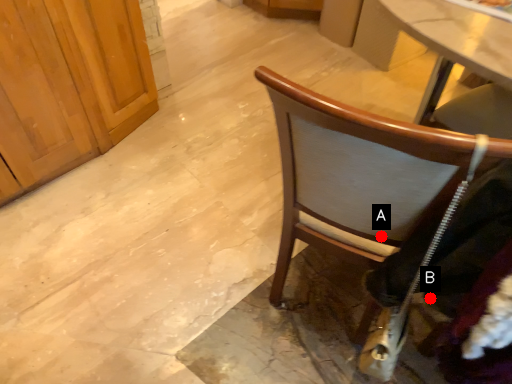
Question: Two points are circled on the image, labeled by A and B beside each circle. Among these points, which one is nearest to the camera?

Choices:
 (A) A is closer
 (B) B is closer

Answer: (B)